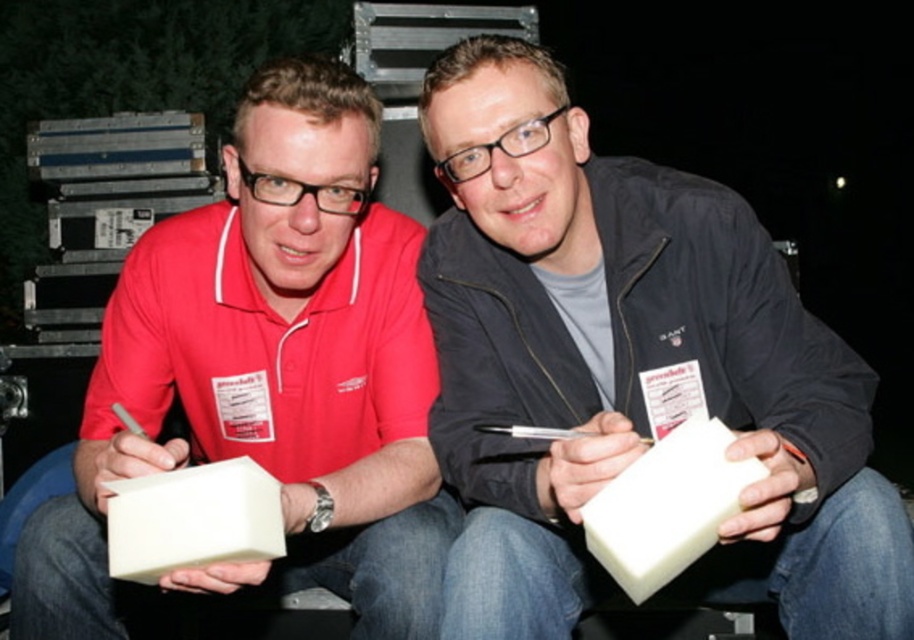
Does matte black jacket at center appear under matte red shirt at center?

Incorrect, matte black jacket at center is not positioned below matte red shirt at center.

Can you confirm if matte black jacket at center is thinner than matte red shirt at center?

Yes.

Image resolution: width=914 pixels, height=640 pixels. Identify the location of matte black jacket at center. (630, 369).